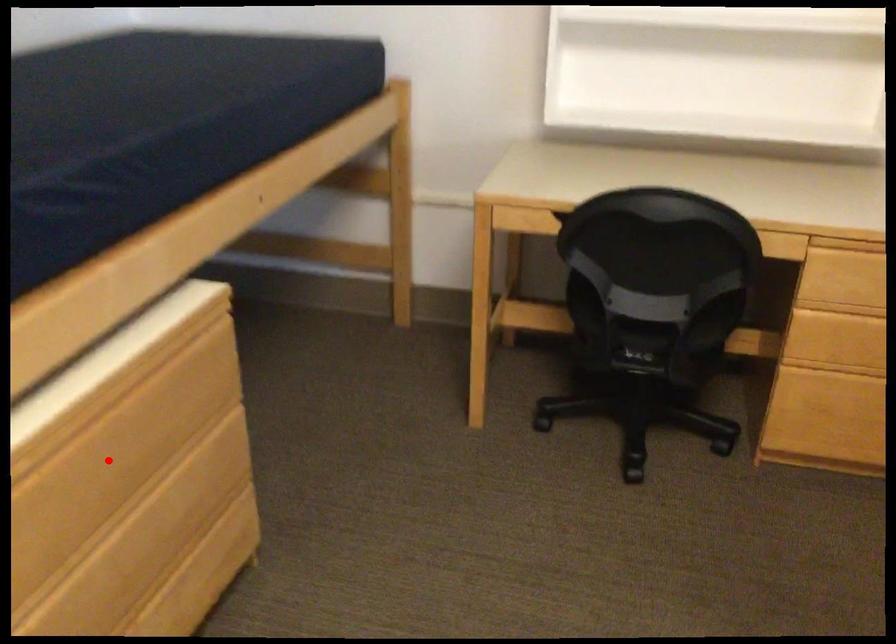
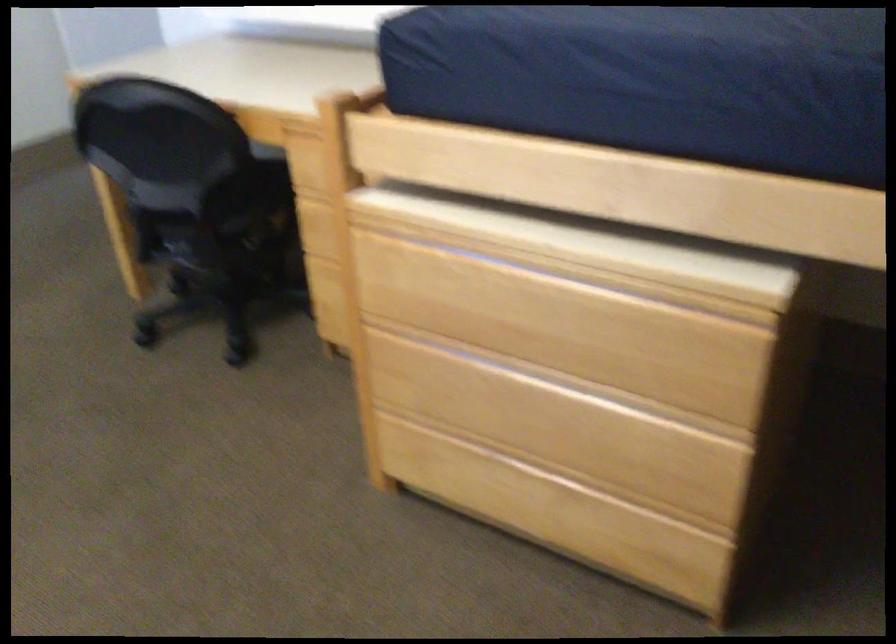
Find the pixel in the second image that matches the highlighted location in the first image.

(543, 315)